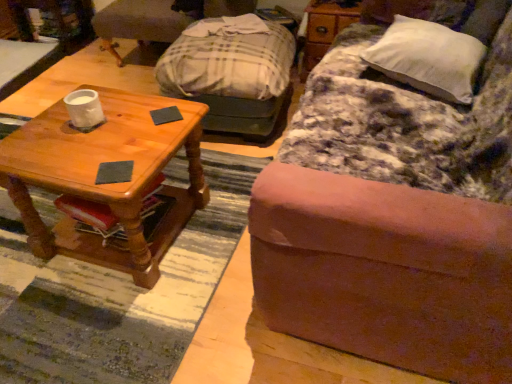
Question: In the image, is dark gray matte coaster at center, the 2th pad in the front-to-back sequence, positioned in front of or behind wooden dresser at upper right?

Choices:
 (A) front
 (B) behind

Answer: (A)

Question: Based on their positions, is dark gray matte coaster at center, the 2th pad in the front-to-back sequence, located to the left or right of wooden dresser at upper right?

Choices:
 (A) left
 (B) right

Answer: (A)

Question: Which of these objects is positioned closest to the wooden dresser at upper right?

Choices:
 (A) dark gray matte coaster at center, the 2th pad in the front-to-back sequence
 (B) gray felt coaster at center, arranged as the second pad when viewed from the back
 (C) white soft pillow at upper right
 (D) brushed metal desk at upper left
 (E) wooden coffee table at left

Answer: (C)

Question: Which object is positioned farthest from the dark gray matte coaster at center, the 2th pad in the front-to-back sequence?

Choices:
 (A) white marble cup at center left
 (B) white soft pillow at upper right
 (C) gray felt coaster at center, which appears as the 1th pad when ordered from the bottom
 (D) wooden coffee table at left
 (E) brushed metal desk at upper left

Answer: (E)